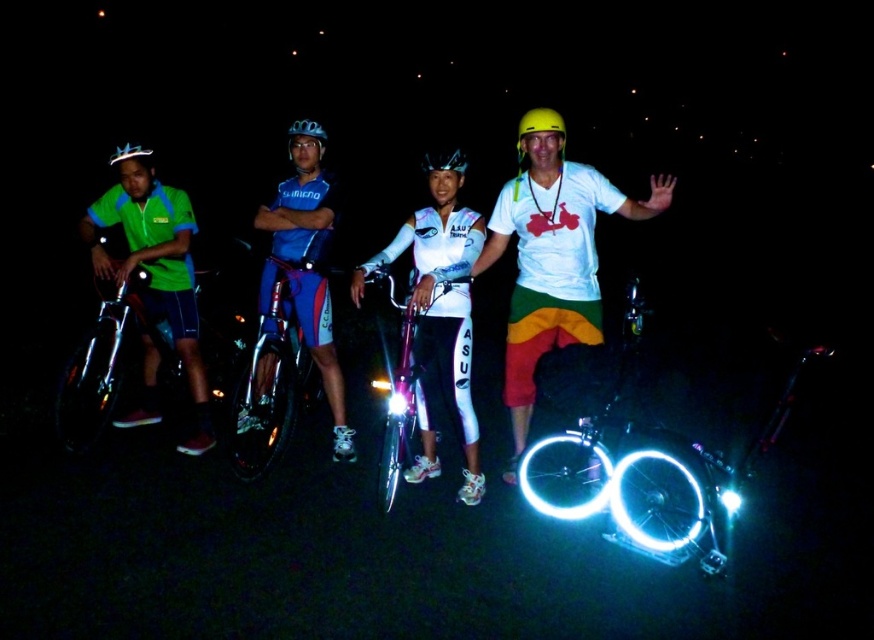
From the picture: Is white reflective wheels at center taller than matte blue helmet at upper center?

Correct, white reflective wheels at center is much taller as matte blue helmet at upper center.

Does white reflective wheels at center have a greater width compared to matte blue helmet at upper center?

Yes.

Which is in front, point (701, 497) or point (297, 125)?

Point (701, 497) is more forward.

Where is `white reflective wheels at center`? The height and width of the screenshot is (640, 874). white reflective wheels at center is located at coordinates (632, 472).

Does white reflective wheels at center appear on the right side of shiny blue frame at center?

Yes, white reflective wheels at center is to the right of shiny blue frame at center.

You are a GUI agent. You are given a task and a screenshot of the screen. Output one action in this format:
    pyautogui.click(x=<x>, y=<y>)
    Task: Click on the white reflective wheels at center
    This screenshot has width=874, height=640.
    Given the screenshot: What is the action you would take?
    pyautogui.click(x=632, y=472)

The width and height of the screenshot is (874, 640). I want to click on white reflective wheels at center, so click(632, 472).

Is yellow matte helmet at center shorter than matte blue helmet at upper center?

In fact, yellow matte helmet at center may be taller than matte blue helmet at upper center.

Which of these two, yellow matte helmet at center or matte blue helmet at upper center, stands taller?

With more height is yellow matte helmet at center.

Between point (515, 147) and point (290, 129), which one is positioned behind?

Point (515, 147)

I want to click on yellow matte helmet at center, so click(539, 129).